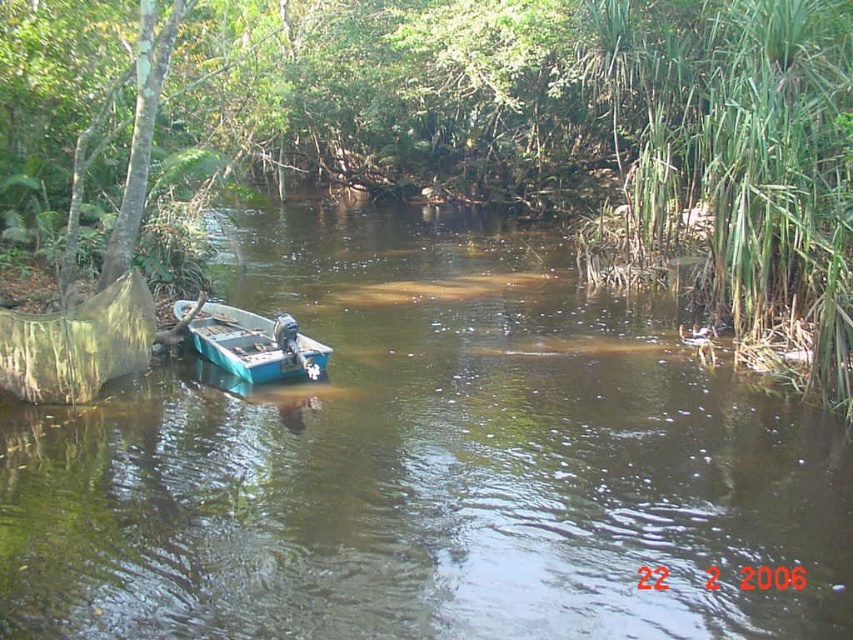
Can you confirm if brown matte boat at center is thinner than teal plastic boat at center?

No, brown matte boat at center is not thinner than teal plastic boat at center.

Image resolution: width=853 pixels, height=640 pixels. Find the location of `brown matte boat at center`. brown matte boat at center is located at coordinates (425, 465).

Who is higher up, brown matte boat at center or green leafy tree at left?

green leafy tree at left

Can you confirm if brown matte boat at center is positioned below green leafy tree at left?

Correct, brown matte boat at center is located below green leafy tree at left.

You are a GUI agent. You are given a task and a screenshot of the screen. Output one action in this format:
    pyautogui.click(x=<x>, y=<y>)
    Task: Click on the brown matte boat at center
    The image size is (853, 640).
    Given the screenshot: What is the action you would take?
    pyautogui.click(x=425, y=465)

Who is shorter, green leafy tree at left or teal plastic boat at center?

With less height is teal plastic boat at center.

This screenshot has width=853, height=640. Identify the location of green leafy tree at left. (608, 132).